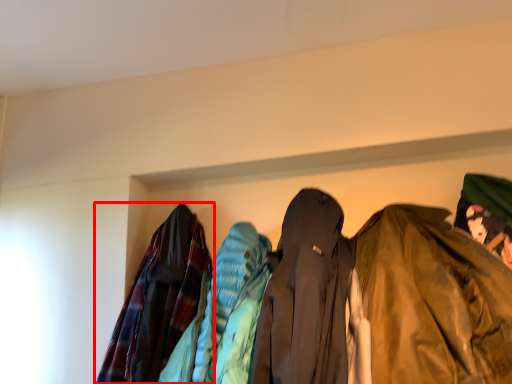
Question: Where is jacket (annotated by the red box) located in relation to jacket in the image?

Choices:
 (A) left
 (B) right

Answer: (A)